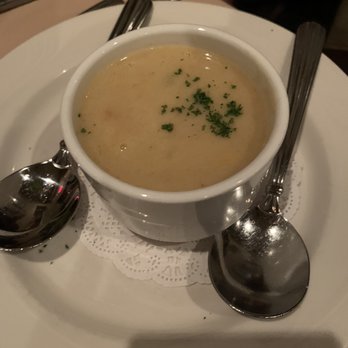
This screenshot has width=348, height=348. I want to click on bowl, so click(x=184, y=211).